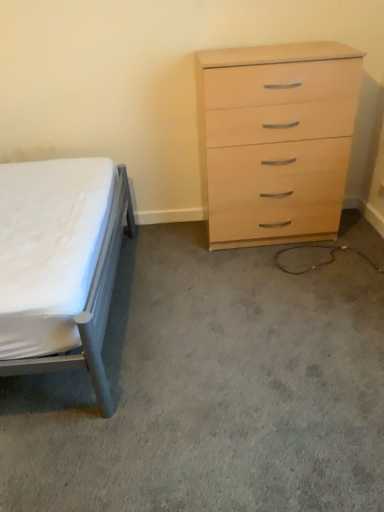
Question: From the image's perspective, is matte gray bed at left located above or below white fabric bed at left?

Choices:
 (A) above
 (B) below

Answer: (A)

Question: In the image, is matte gray bed at left positioned in front of or behind white fabric bed at left?

Choices:
 (A) front
 (B) behind

Answer: (A)

Question: Which object is the closest to the matte gray bed at left?

Choices:
 (A) white fabric bed at left
 (B) light wood/veneer chest of drawers at right

Answer: (A)

Question: Which is nearer to the light wood/veneer chest of drawers at right?

Choices:
 (A) white fabric bed at left
 (B) matte gray bed at left

Answer: (A)